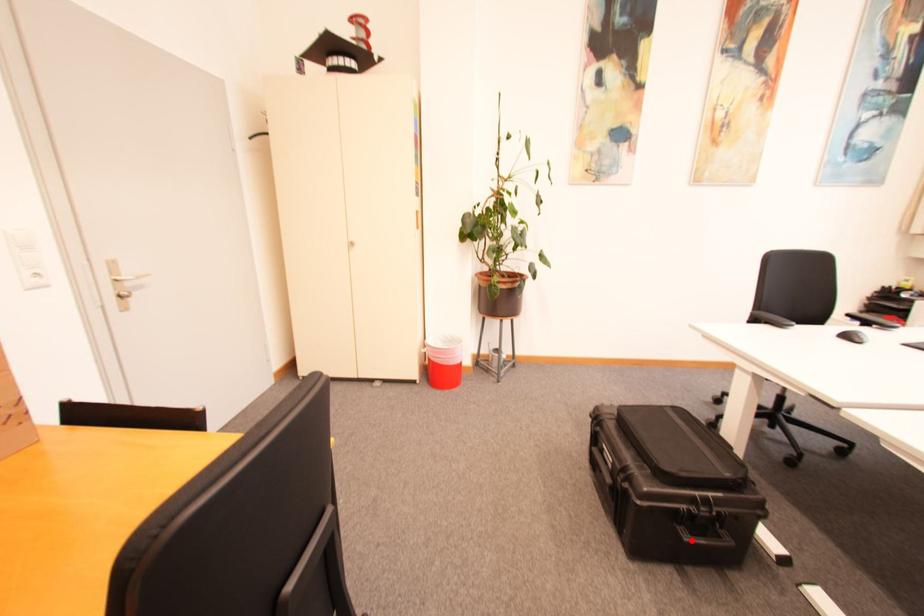
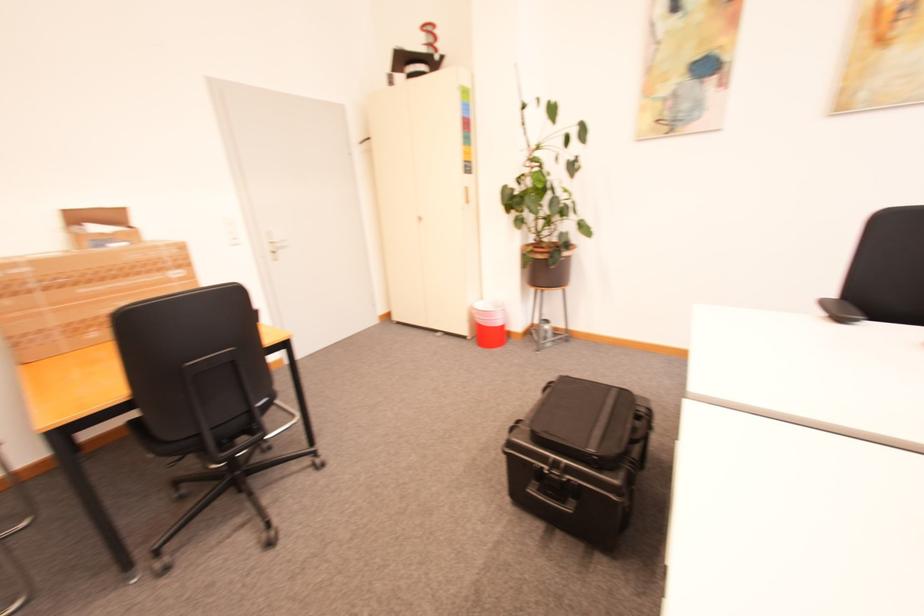
The point at the highlighted location is marked in the first image. Where is the corresponding point in the second image?

(535, 492)